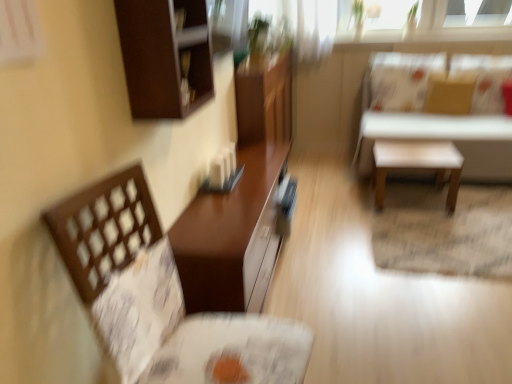
Question: Should I look upward or downward to see brown woven chair at left?

Choices:
 (A) down
 (B) up

Answer: (A)

Question: Considering the relative sizes of white matte stool at upper right, the first table positioned from the back, and brown woven chair at left in the image provided, is white matte stool at upper right, the first table positioned from the back, bigger than brown woven chair at left?

Choices:
 (A) yes
 (B) no

Answer: (A)

Question: From the image's perspective, does white matte stool at upper right, which is the 1th table in right-to-left order, appear lower than brown woven chair at left?

Choices:
 (A) yes
 (B) no

Answer: (B)

Question: Is white matte stool at upper right, acting as the second table starting from the left, placed right next to brown woven chair at left?

Choices:
 (A) yes
 (B) no

Answer: (B)

Question: Is white matte stool at upper right, the first table positioned from the back, shorter than brown woven chair at left?

Choices:
 (A) yes
 (B) no

Answer: (A)

Question: From a real-world perspective, is white matte stool at upper right, the first table positioned from the back, physically below brown woven chair at left?

Choices:
 (A) yes
 (B) no

Answer: (A)

Question: From the image's perspective, is white matte stool at upper right, which is the 1th table in right-to-left order, above brown woven chair at left?

Choices:
 (A) no
 (B) yes

Answer: (B)

Question: Considering the relative sizes of matte brown table at center, which is the first table from left to right, and white matte stool at center in the image provided, is matte brown table at center, which is the first table from left to right, bigger than white matte stool at center?

Choices:
 (A) yes
 (B) no

Answer: (A)

Question: Is the surface of matte brown table at center, which is the first table from left to right, in direct contact with white matte stool at center?

Choices:
 (A) no
 (B) yes

Answer: (A)

Question: Are matte brown table at center, the 2th table positioned from the back, and white matte stool at center located far from each other?

Choices:
 (A) no
 (B) yes

Answer: (B)

Question: Could you tell me if matte brown table at center, the 2th table positioned from the back, is turned towards white matte stool at center?

Choices:
 (A) no
 (B) yes

Answer: (B)

Question: Is matte brown table at center, the 2th table positioned from the back, positioned beyond the bounds of white matte stool at center?

Choices:
 (A) yes
 (B) no

Answer: (A)

Question: Is white matte stool at center surrounded by matte brown table at center, the 2th table positioned from the back?

Choices:
 (A) no
 (B) yes

Answer: (A)

Question: Is dark brown wood cabinet at upper left surrounding matte brown table at center, arranged as the first table when viewed from the front?

Choices:
 (A) yes
 (B) no

Answer: (B)